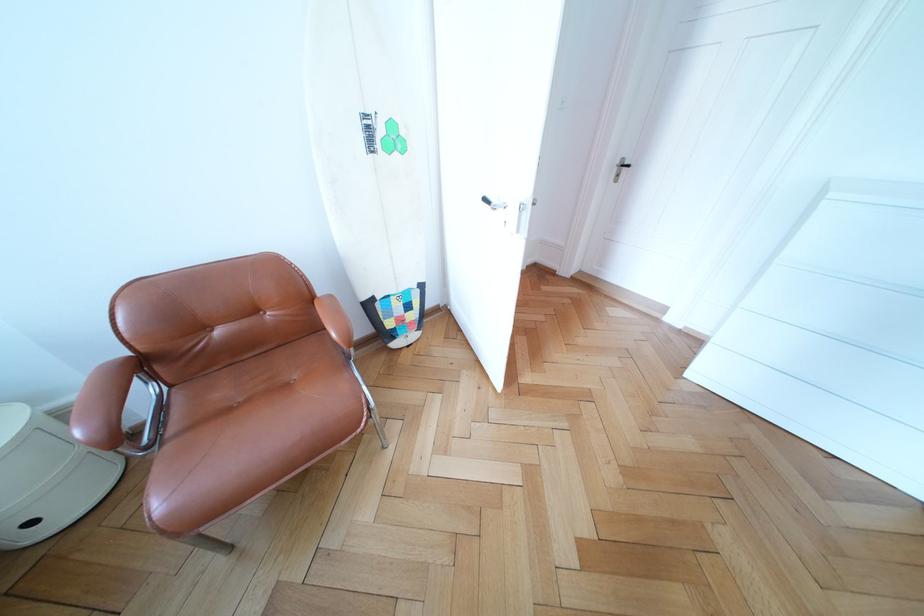
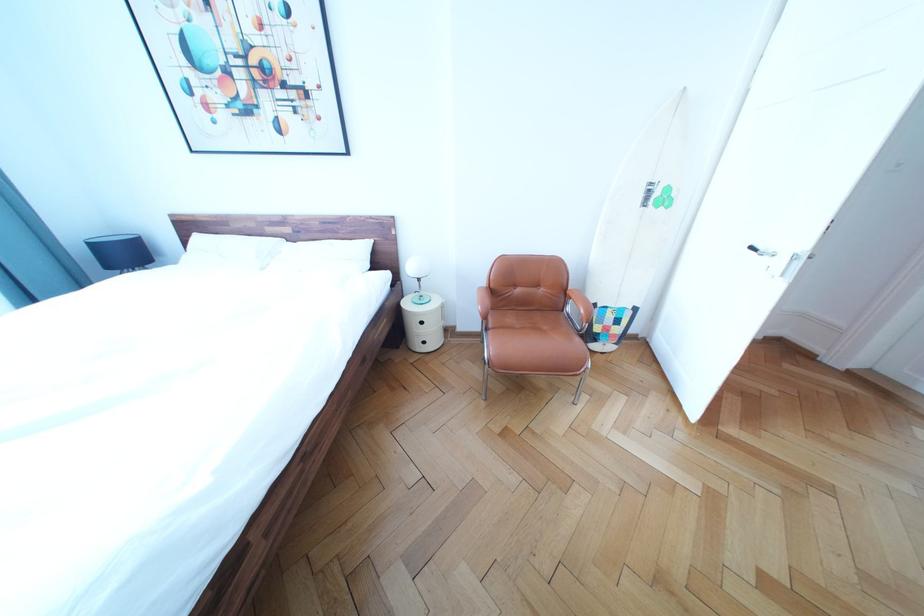
Question: The camera is either moving clockwise (left) or counter-clockwise (right) around the object. The first image is from the beginning of the video and the second image is from the end. Is the camera moving left or right when shooting the video?

Choices:
 (A) Left
 (B) Right

Answer: (B)